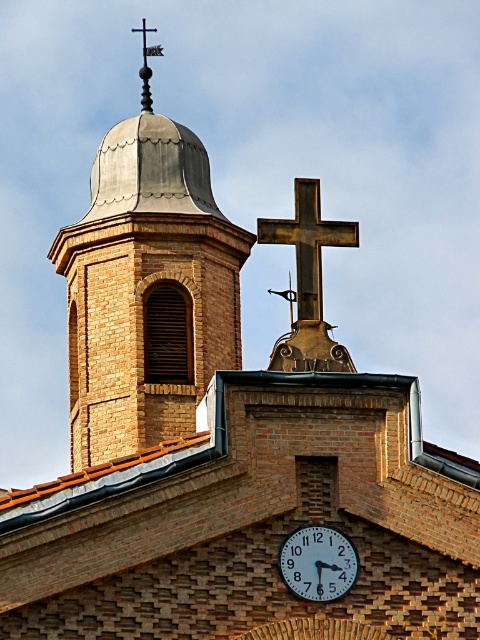
Between gray metallic dome at upper center and white glossy clock at center, which one is positioned higher?

gray metallic dome at upper center is higher up.

Can you confirm if gray metallic dome at upper center is bigger than white glossy clock at center?

Indeed, gray metallic dome at upper center has a larger size compared to white glossy clock at center.

Is point (110, 328) farther from viewer compared to point (301, 531)?

That is True.

Where is `gray metallic dome at upper center`? This screenshot has width=480, height=640. gray metallic dome at upper center is located at coordinates (146, 288).

Identify the location of dark brown wooden cross at center. (308, 243).

Based on the photo, does dark brown wooden cross at center have a smaller size compared to white glossy clock at center?

No.

Identify the location of dark brown wooden cross at center. (308, 243).

Find the location of a particular element. dark brown wooden cross at center is located at coordinates (308, 243).

Looking at this image, which is more to the right, gray metallic dome at upper center or dark brown wooden cross at center?

dark brown wooden cross at center is more to the right.

Is gray metallic dome at upper center shorter than dark brown wooden cross at center?

No, gray metallic dome at upper center is not shorter than dark brown wooden cross at center.

Where is `gray metallic dome at upper center`? The image size is (480, 640). gray metallic dome at upper center is located at coordinates (146, 288).